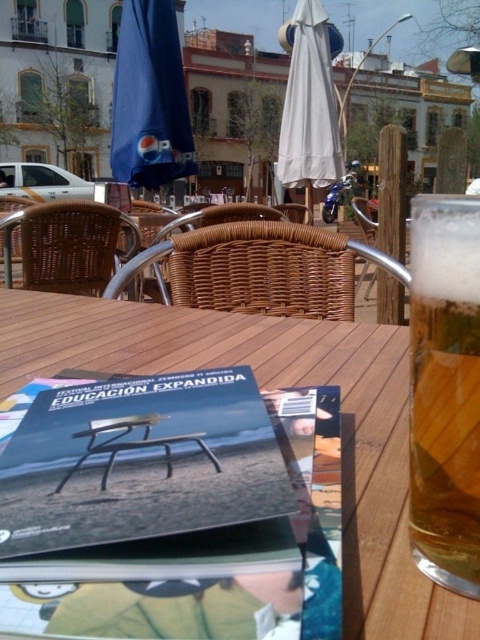
Does wooden table at center appear on the right side of golden amber liquid at right?

Incorrect, wooden table at center is not on the right side of golden amber liquid at right.

Which is in front, point (324, 376) or point (432, 330)?

Positioned in front is point (432, 330).

Between point (231, 346) and point (465, 307), which one is positioned in front?

Point (465, 307)

At what (x,y) coordinates should I click in order to perform the action: click on wooden table at center. Please return your answer as a coordinate pair (x, y). Looking at the image, I should click on (268, 388).

Can you confirm if matte black magazine at center is smaller than golden amber liquid at right?

Correct, matte black magazine at center occupies less space than golden amber liquid at right.

Is point (173, 476) closer to camera compared to point (450, 476)?

No, it is not.

At what (x,y) coordinates should I click in order to perform the action: click on matte black magazine at center. Please return your answer as a coordinate pair (x, y). Looking at the image, I should click on (140, 461).

This screenshot has width=480, height=640. What do you see at coordinates (268, 388) in the screenshot?
I see `wooden table at center` at bounding box center [268, 388].

Can you confirm if wooden table at center is positioned above matte black magazine at center?

Yes.

Does point (8, 316) lie behind point (96, 499)?

Yes, it is behind point (96, 499).

Find the location of a particular element. wooden table at center is located at coordinates (268, 388).